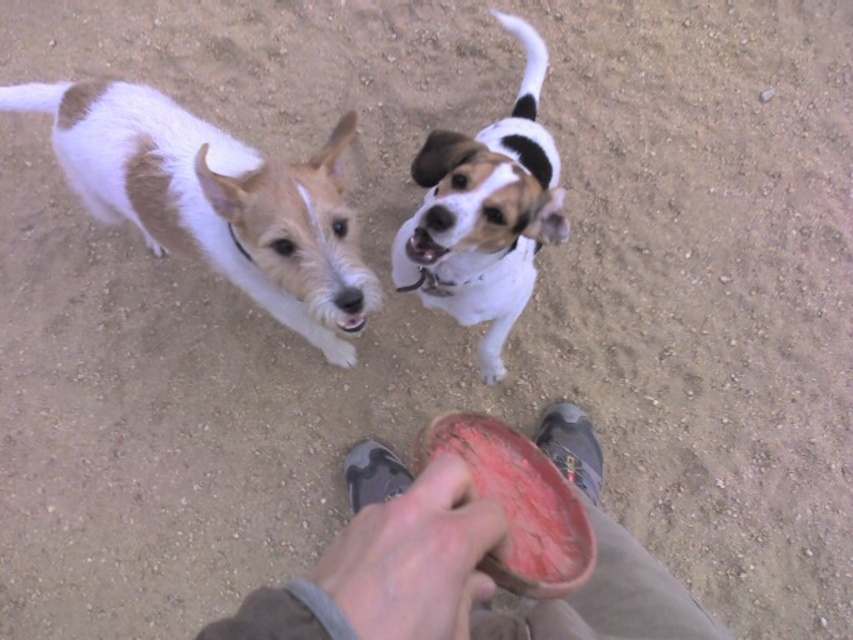
Question: Is brown and white fur at upper left to the right of white fur dog at upper center from the viewer's perspective?

Choices:
 (A) yes
 (B) no

Answer: (B)

Question: Considering the relative positions of smooth leather shoe at lower center and brown and white fur at upper left in the image provided, where is smooth leather shoe at lower center located with respect to brown and white fur at upper left?

Choices:
 (A) left
 (B) right

Answer: (B)

Question: Which object is positioned farthest from the white fur dog at upper center?

Choices:
 (A) smooth red frisbee at center
 (B) smooth leather shoe at lower center
 (C) brown and white fur at upper left

Answer: (B)

Question: Which object is farther from the camera taking this photo?

Choices:
 (A) smooth red frisbee at center
 (B) brown and white fur at upper left
 (C) white fur dog at upper center

Answer: (C)

Question: Is smooth leather shoe at lower center closer to camera compared to smooth red frisbee at center?

Choices:
 (A) no
 (B) yes

Answer: (B)

Question: Which of the following is the farthest from the observer?

Choices:
 (A) (494, 337)
 (B) (439, 612)
 (C) (308, 276)
 (D) (459, 424)

Answer: (A)